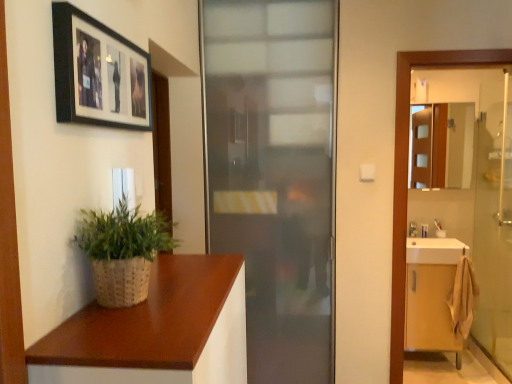
Question: Is clear glass screen door at right aimed at brown wood countertop at lower left?

Choices:
 (A) yes
 (B) no

Answer: (B)

Question: Does clear glass screen door at right have a lesser height compared to brown wood countertop at lower left?

Choices:
 (A) yes
 (B) no

Answer: (B)

Question: From the image's perspective, is clear glass screen door at right beneath brown wood countertop at lower left?

Choices:
 (A) yes
 (B) no

Answer: (B)

Question: Is clear glass screen door at right facing away from brown wood countertop at lower left?

Choices:
 (A) no
 (B) yes

Answer: (A)

Question: From a real-world perspective, is clear glass screen door at right positioned over brown wood countertop at lower left based on gravity?

Choices:
 (A) no
 (B) yes

Answer: (B)

Question: Is clear glass screen door at right not within brown wood countertop at lower left?

Choices:
 (A) no
 (B) yes

Answer: (B)

Question: Is brown wood countertop at lower left smaller than wooden cabinet at right?

Choices:
 (A) yes
 (B) no

Answer: (B)

Question: From the image's perspective, is brown wood countertop at lower left located above wooden cabinet at right?

Choices:
 (A) no
 (B) yes

Answer: (A)

Question: Can you confirm if brown wood countertop at lower left is wider than wooden cabinet at right?

Choices:
 (A) no
 (B) yes

Answer: (B)

Question: From a real-world perspective, is brown wood countertop at lower left located higher than wooden cabinet at right?

Choices:
 (A) no
 (B) yes

Answer: (A)

Question: Does brown wood countertop at lower left have a larger size compared to wooden cabinet at right?

Choices:
 (A) yes
 (B) no

Answer: (A)

Question: Can you confirm if brown wood countertop at lower left is thinner than wooden cabinet at right?

Choices:
 (A) no
 (B) yes

Answer: (A)

Question: Is frosted glass door at center facing away from transparent glass elevator at right?

Choices:
 (A) yes
 (B) no

Answer: (B)